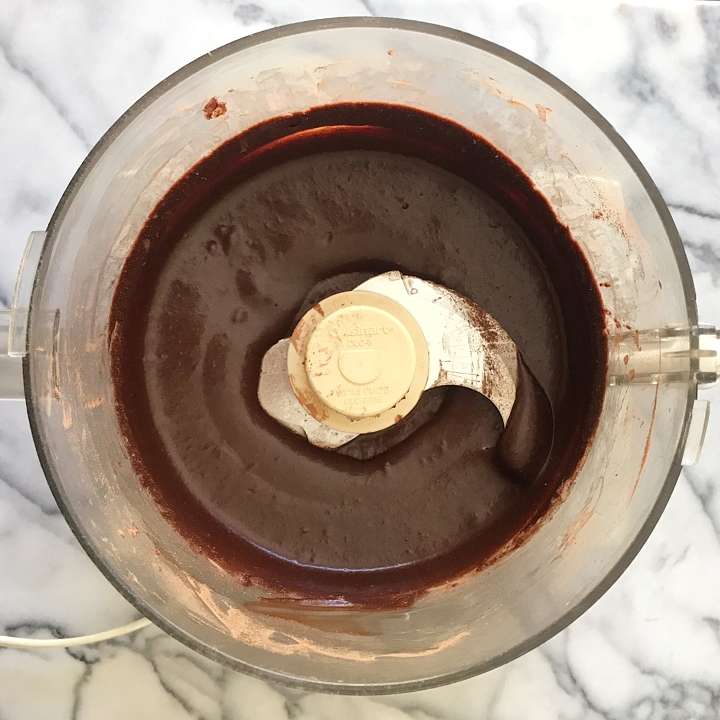
Find the location of a particular element. The image size is (720, 720). pitcher is located at coordinates coord(684,273).